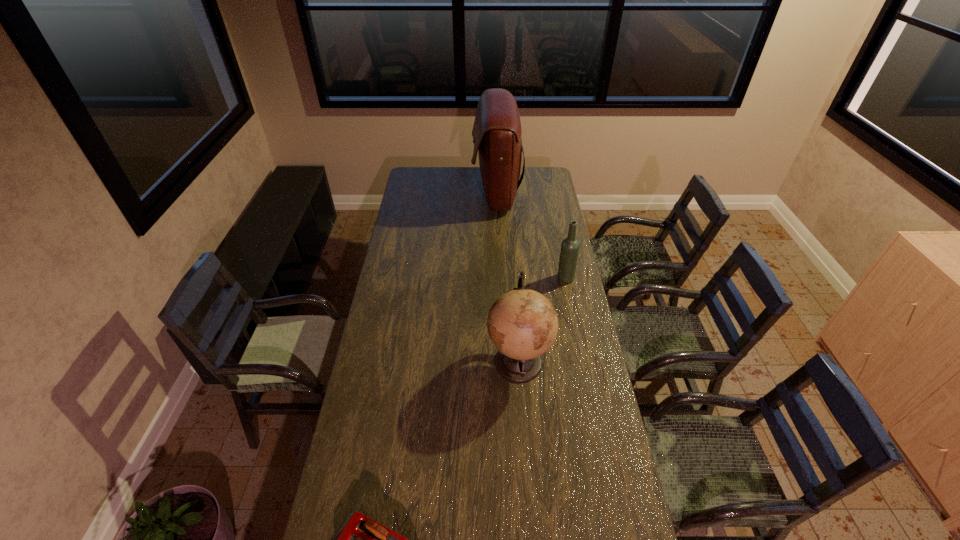
The image size is (960, 540). I want to click on empty location between the globe and the satchel, so click(x=507, y=277).

Where is `free space that is in between the rightmost object and the farthest object`? free space that is in between the rightmost object and the farthest object is located at coordinates (531, 235).

In order to click on vacant region between the rightmost object and the farthest object in this screenshot , I will do `click(531, 235)`.

Identify which object is the nearest to the third farthest object. Please provide its 2D coordinates. Your answer should be formatted as a tuple, i.e. [(x, y)], where the tuple contains the x and y coordinates of a point satisfying the conditions above.

[(570, 246)]

Select which object appears as the closest to the farthest object. Please provide its 2D coordinates. Your answer should be formatted as a tuple, i.e. [(x, y)], where the tuple contains the x and y coordinates of a point satisfying the conditions above.

[(570, 246)]

Image resolution: width=960 pixels, height=540 pixels. I want to click on free location that satisfies the following two spatial constraints: 1. on the open flap of the tallest object; 2. on the back side of the second shortest object, so click(500, 278).

At what (x,y) coordinates should I click in order to perform the action: click on free spot that satisfies the following two spatial constraints: 1. on the open flap of the farthest object; 2. on the right side of the wine bottle. Please return your answer as a coordinate pair (x, y). Looking at the image, I should click on (500, 278).